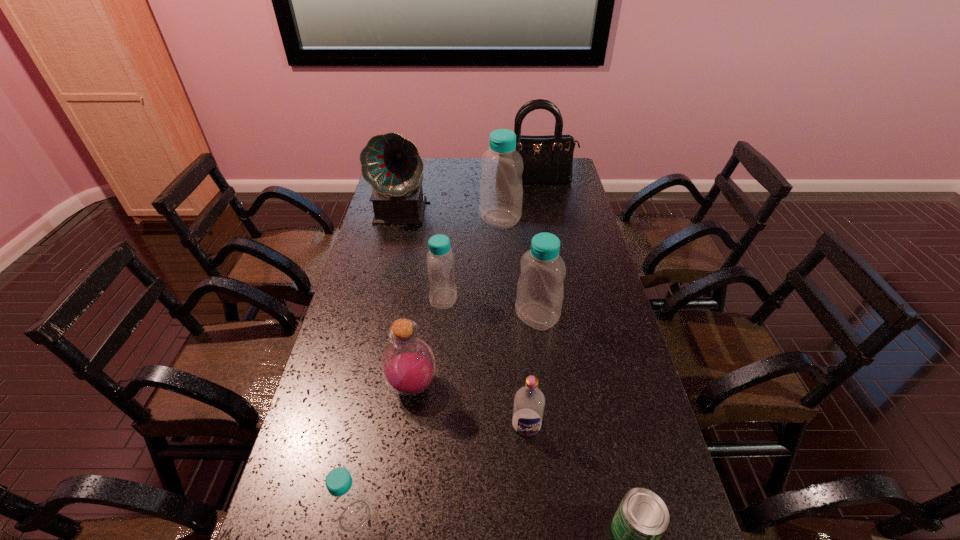
The image size is (960, 540). I want to click on record player, so click(x=391, y=164).

Where is `the farthest object`? The height and width of the screenshot is (540, 960). the farthest object is located at coordinates (548, 159).

Image resolution: width=960 pixels, height=540 pixels. I want to click on handbag, so click(548, 159).

Find the location of a particular element. the tallest bottle is located at coordinates (501, 190).

The width and height of the screenshot is (960, 540). I want to click on the biggest blue bottle, so click(501, 190).

I want to click on the second tallest bottle, so click(540, 290).

This screenshot has height=540, width=960. What are the coordinates of `the fourth tallest object` in the screenshot? It's located at (540, 290).

Identify the location of the third biggest blue bottle. Image resolution: width=960 pixels, height=540 pixels. (440, 259).

Locate an element on the screen. purple bottle is located at coordinates (408, 366).

Locate an element on the screen. The height and width of the screenshot is (540, 960). the fourth farthest bottle is located at coordinates (408, 366).